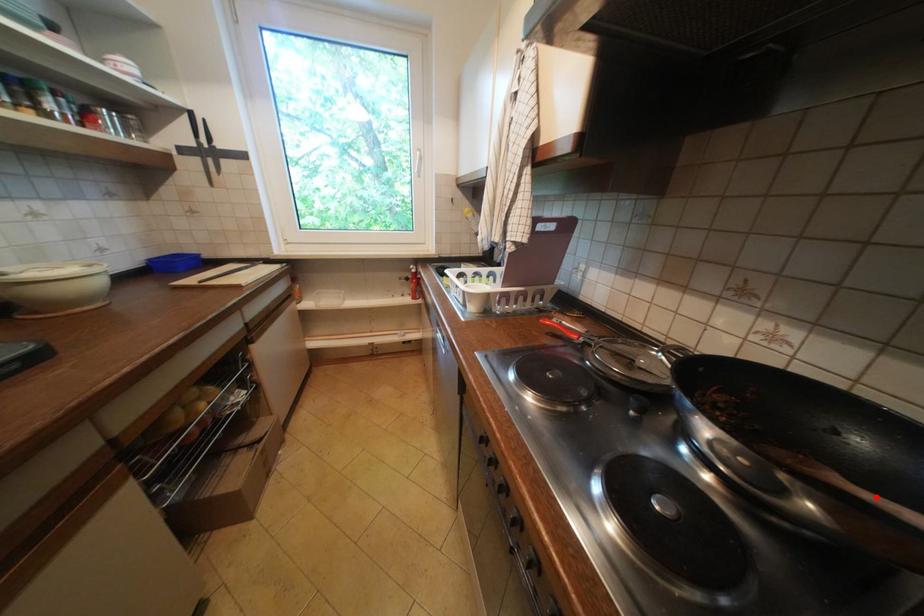
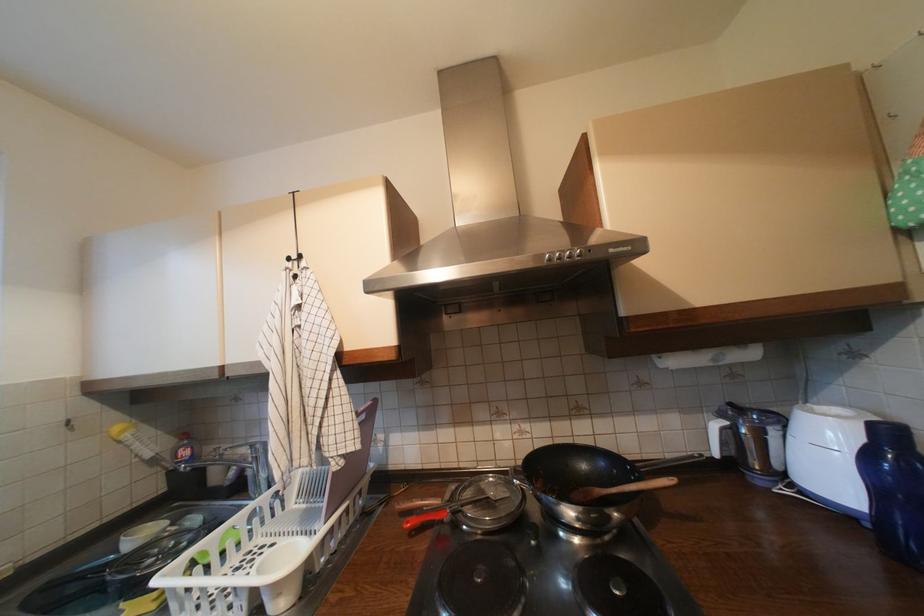
Find the pixel in the second image that matches the highlighted location in the first image.

(623, 492)